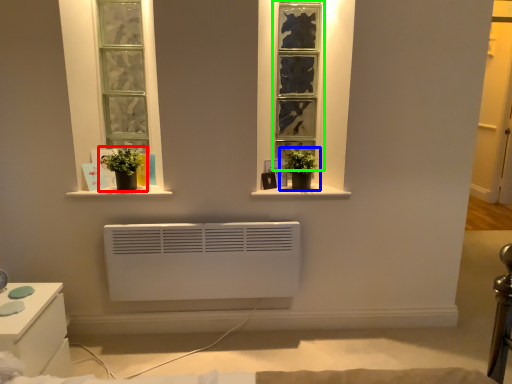
Question: Considering the real-world distances, which object is farthest from houseplant (highlighted by a red box)? houseplant (highlighted by a blue box) or window (highlighted by a green box)?

Choices:
 (A) houseplant
 (B) window

Answer: (B)